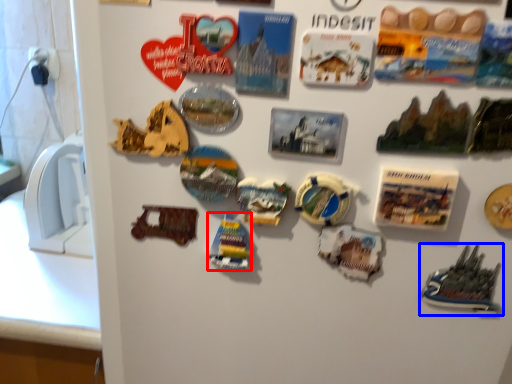
Question: Which object appears closest to the camera in this image, stuff (highlighted by a red box) or toy (highlighted by a blue box)?

Choices:
 (A) stuff
 (B) toy

Answer: (B)